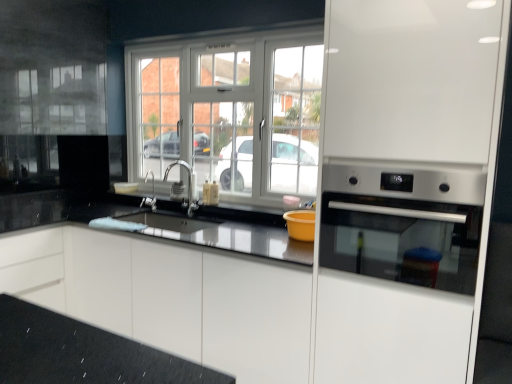
Question: Based on their positions, is satin nickel faucet at center located to the left or right of satin silver oven at right?

Choices:
 (A) right
 (B) left

Answer: (B)

Question: In terms of size, does satin nickel faucet at center appear bigger or smaller than satin silver oven at right?

Choices:
 (A) small
 (B) big

Answer: (A)

Question: Considering the real-world distances, which object is closest to the satin nickel faucet at center?

Choices:
 (A) satin silver oven at right
 (B) satin nickel faucet at center
 (C) white glossy cabinet at center
 (D) stainless steel oven at right
 (E) white plastic window at center

Answer: (B)

Question: Estimate the real-world distances between objects in this image. Which object is farther from the satin nickel faucet at center?

Choices:
 (A) white glossy cabinet at center
 (B) stainless steel oven at right
 (C) satin nickel faucet at center
 (D) white plastic window at center
 (E) satin silver oven at right

Answer: (B)